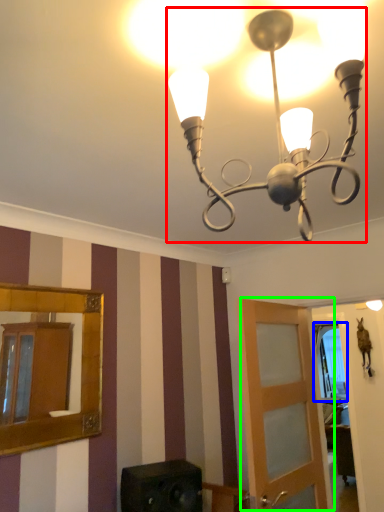
Question: Which object is the closest to the lamp (highlighted by a red box)? Choose among these: window (highlighted by a blue box) or door (highlighted by a green box).

Choices:
 (A) window
 (B) door

Answer: (B)